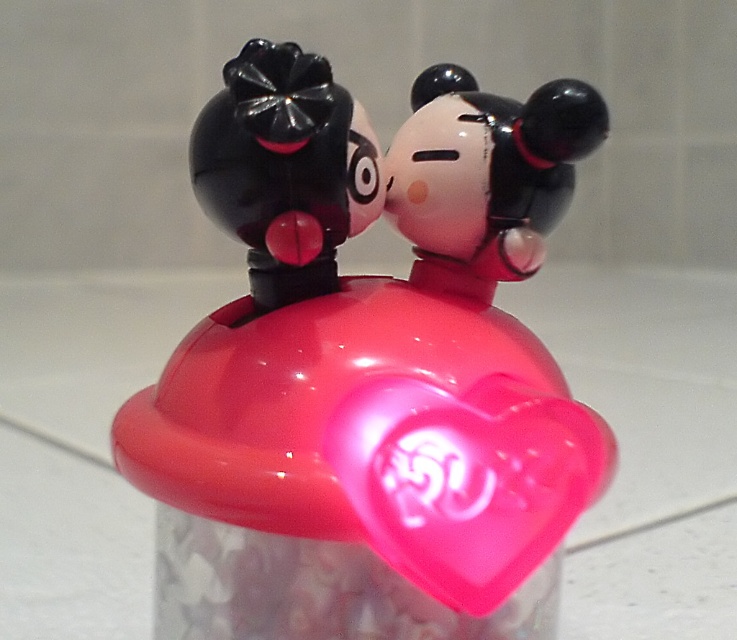
You are organizing a display and need to place both the glossy plastic heart at center and the glossy plastic figurine at center on a shelf. If the shelf has limited space, which object should you prioritize placing first to ensure both fit?

Since the glossy plastic heart at center is smaller than the glossy plastic figurine at center, you should prioritize placing the glossy plastic figurine at center first to accommodate its larger size, then fit the glossy plastic heart at center around it.

You are a toy collector who wants to display both the glossy plastic heart at center and the glossy plastic figurine at center on a shelf. If you want to arrange them so that the figurine is visible from behind the heart, is this possible?

The glossy plastic heart at center is in front of the glossy plastic figurine at center, so arranging them to have the figurine visible behind the heart would require moving the heart to the back. Currently, the heart blocks the view of the figurine behind it.